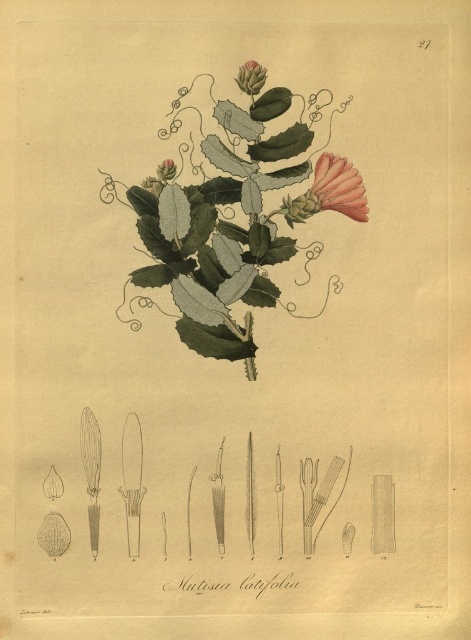
Is pink matte flower at upper right thinner than green matte flower at upper center?

No.

Consider the image. Is pink matte flower at upper right wider than green matte flower at upper center?

Yes, pink matte flower at upper right is wider than green matte flower at upper center.

Which is in front, point (347, 198) or point (256, 74)?

Point (256, 74)

This screenshot has height=640, width=471. Identify the location of pink matte flower at upper right. (330, 192).

Does green glossy leaves at center appear on the right side of green matte leaf at upper center?

Yes, green glossy leaves at center is to the right of green matte leaf at upper center.

Who is lower down, green glossy leaves at center or green matte leaf at upper center?

green glossy leaves at center is below.

Is point (256, 376) positioned after point (157, 170)?

That is True.

The width and height of the screenshot is (471, 640). What are the coordinates of `green glossy leaves at center` in the screenshot? It's located at (233, 221).

This screenshot has width=471, height=640. What do you see at coordinates (233, 221) in the screenshot?
I see `green glossy leaves at center` at bounding box center [233, 221].

Can you confirm if green glossy leaves at center is taller than green matte flower at upper center?

Correct, green glossy leaves at center is much taller as green matte flower at upper center.

Which is behind, point (313, 209) or point (259, 65)?

Point (313, 209)

Identify the location of green glossy leaves at center. (233, 221).